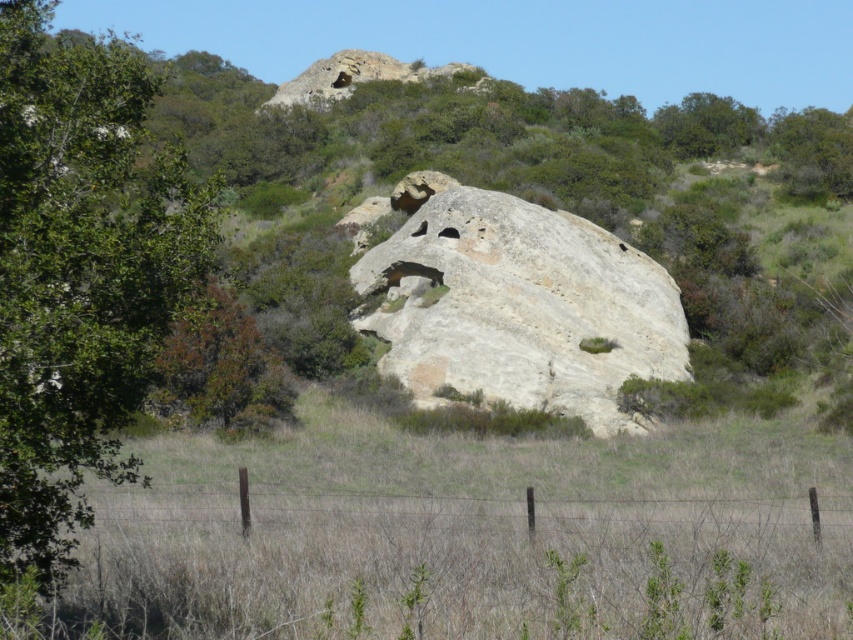
You are planning to place a new sign that is 2 meters wide between the brown wire fence at lower center and the green leafy tree at upper right. Based on their widths, will the sign fit between them without overlapping either object?

The brown wire fence at lower center is narrower than the green leafy tree at upper right. However, the exact distance between them isn not specified in the objects description. The question asks about fitting a 2m wide sign between them, but the objects description only provides information about their widths, not the space between them. Therefore, we cannot determine if the sign will fit based solely on the given information.